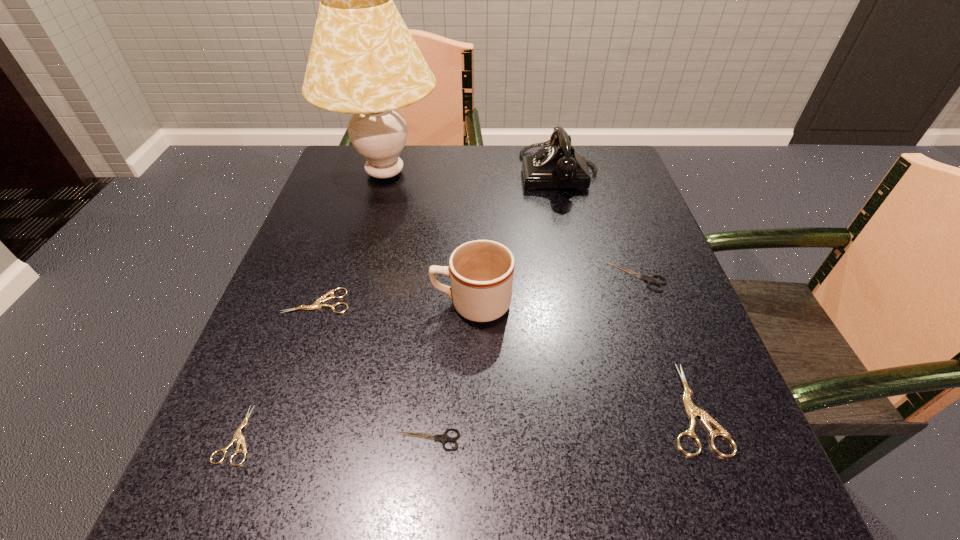
You are a GUI agent. You are given a task and a screenshot of the screen. Output one action in this format:
    pyautogui.click(x=<x>, y=<y>)
    Task: Click on the shears that stands as the third closest to the yellow lampshade
    
    Given the screenshot: What is the action you would take?
    pyautogui.click(x=238, y=436)

Identify which beige shears is the second closest to the biggest beige shears. Please provide its 2D coordinates. Your answer should be formatted as a tuple, i.e. [(x, y)], where the tuple contains the x and y coordinates of a point satisfying the conditions above.

[(238, 436)]

Locate which beige shears is the second closest to the farther black shears. Please provide its 2D coordinates. Your answer should be formatted as a tuple, i.e. [(x, y)], where the tuple contains the x and y coordinates of a point satisfying the conditions above.

[(316, 305)]

Find the location of `free space that satisfies the following two spatial constraints: 1. on the side of the mug with the handle; 2. on the right side of the bigger black shears`. free space that satisfies the following two spatial constraints: 1. on the side of the mug with the handle; 2. on the right side of the bigger black shears is located at coordinates (472, 276).

At what (x,y) coordinates should I click in order to perform the action: click on free space that satisfies the following two spatial constraints: 1. on the back side of the biggest beige shears; 2. on the dial of the black telephone. Please return your answer as a coordinate pair (x, y). This screenshot has width=960, height=540. Looking at the image, I should click on (605, 173).

Identify the location of free location that satisfies the following two spatial constraints: 1. on the back side of the bigger black shears; 2. on the left side of the third shears from right to left. (442, 276).

Where is `free spot that satisfies the following two spatial constraints: 1. on the side of the brown mug with the handle; 2. on the front side of the yellow lampshade`? free spot that satisfies the following two spatial constraints: 1. on the side of the brown mug with the handle; 2. on the front side of the yellow lampshade is located at coordinates (474, 173).